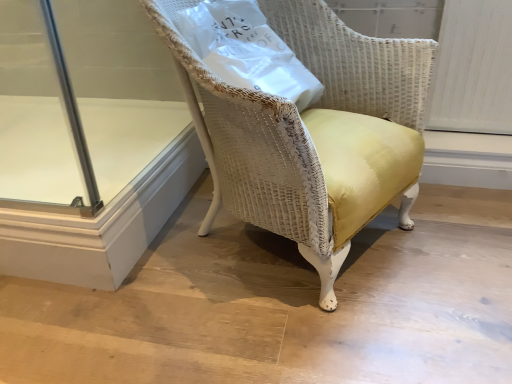
Question: Does yellow fabric chair at center turn towards white paper bag at upper center?

Choices:
 (A) yes
 (B) no

Answer: (A)

Question: Considering the relative positions of yellow fabric chair at center and white paper bag at upper center in the image provided, is yellow fabric chair at center to the left of white paper bag at upper center from the viewer's perspective?

Choices:
 (A) yes
 (B) no

Answer: (B)

Question: Is yellow fabric chair at center positioned with its back to white paper bag at upper center?

Choices:
 (A) yes
 (B) no

Answer: (A)

Question: Considering the relative sizes of yellow fabric chair at center and white paper bag at upper center in the image provided, is yellow fabric chair at center wider than white paper bag at upper center?

Choices:
 (A) yes
 (B) no

Answer: (A)

Question: Are yellow fabric chair at center and white paper bag at upper center far apart?

Choices:
 (A) no
 (B) yes

Answer: (A)

Question: From a real-world perspective, relative to yellow fabric chair at center, is transparent glass door at lower left vertically above or below?

Choices:
 (A) above
 (B) below

Answer: (B)

Question: Do you think transparent glass door at lower left is within yellow fabric chair at center, or outside of it?

Choices:
 (A) inside
 (B) outside

Answer: (B)

Question: In the image, is transparent glass door at lower left positioned in front of or behind yellow fabric chair at center?

Choices:
 (A) front
 (B) behind

Answer: (B)

Question: Considering the positions of transparent glass door at lower left and yellow fabric chair at center in the image, is transparent glass door at lower left taller or shorter than yellow fabric chair at center?

Choices:
 (A) short
 (B) tall

Answer: (A)

Question: Visually, is white paper bag at upper center positioned to the left or to the right of yellow fabric chair at center?

Choices:
 (A) right
 (B) left

Answer: (B)

Question: From the image's perspective, is white paper bag at upper center positioned above or below yellow fabric chair at center?

Choices:
 (A) below
 (B) above

Answer: (B)

Question: Considering their positions, is white paper bag at upper center located in front of or behind yellow fabric chair at center?

Choices:
 (A) behind
 (B) front

Answer: (A)

Question: Does point (276, 39) appear closer or farther from the camera than point (241, 192)?

Choices:
 (A) closer
 (B) farther

Answer: (B)

Question: Choose the correct answer: Is white paper bag at upper center inside transparent glass door at lower left or outside it?

Choices:
 (A) outside
 (B) inside

Answer: (A)

Question: From a real-world perspective, is white paper bag at upper center above or below transparent glass door at lower left?

Choices:
 (A) above
 (B) below

Answer: (A)